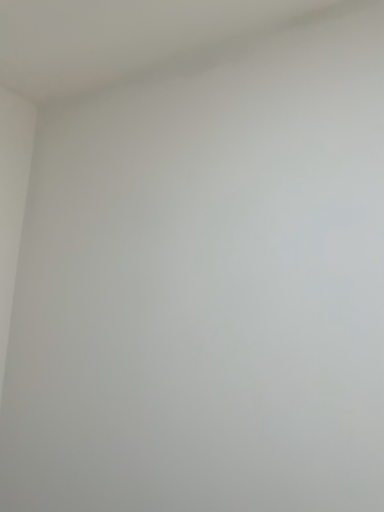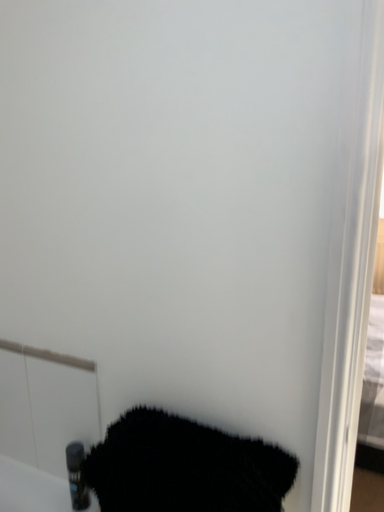
Question: How did the camera likely rotate when shooting the video?

Choices:
 (A) rotated right
 (B) rotated left

Answer: (A)